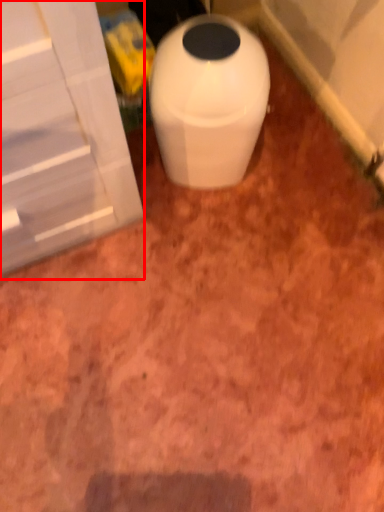
Question: In this image, where is screen door (annotated by the red box) located relative to waste container?

Choices:
 (A) left
 (B) right

Answer: (A)